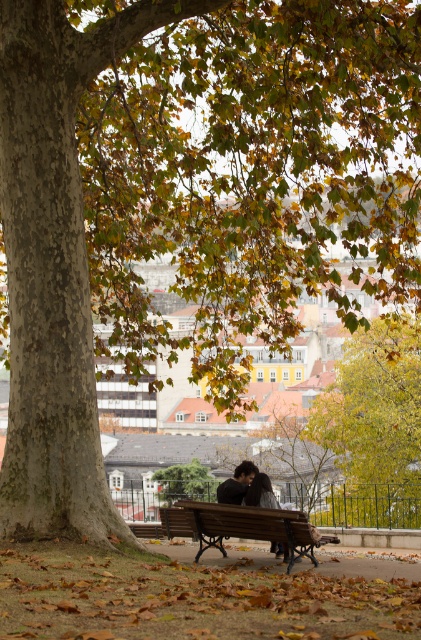
Question: Does brown leaf litter at lower center have a greater width compared to dark brown leather coat at center?

Choices:
 (A) no
 (B) yes

Answer: (B)

Question: Which object appears closest to the camera in this image?

Choices:
 (A) brown leaf litter at lower center
 (B) yellow-green foliage at center

Answer: (A)

Question: Does yellow-green foliage at center appear on the right side of green leafy tree at center?

Choices:
 (A) no
 (B) yes

Answer: (B)

Question: Is brown leaf litter at lower center positioned in front of green leafy tree at center?

Choices:
 (A) yes
 (B) no

Answer: (A)

Question: Which object is farther from the camera taking this photo?

Choices:
 (A) wooden bench at center
 (B) green leafy tree at center

Answer: (B)

Question: Which of the following is the farthest from the observer?

Choices:
 (A) green leafy tree at center
 (B) dark brown leather coat at center
 (C) brown leaf litter at lower center

Answer: (A)